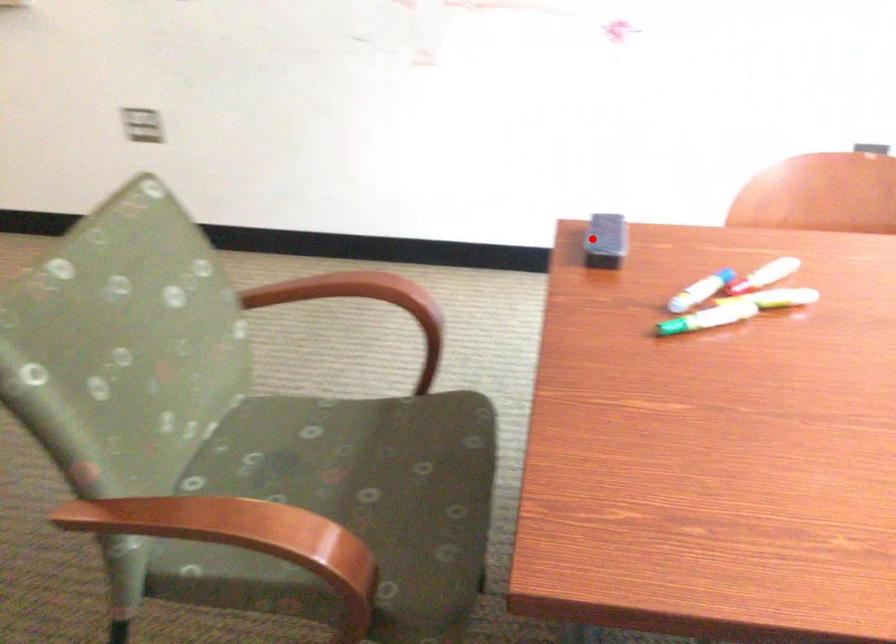
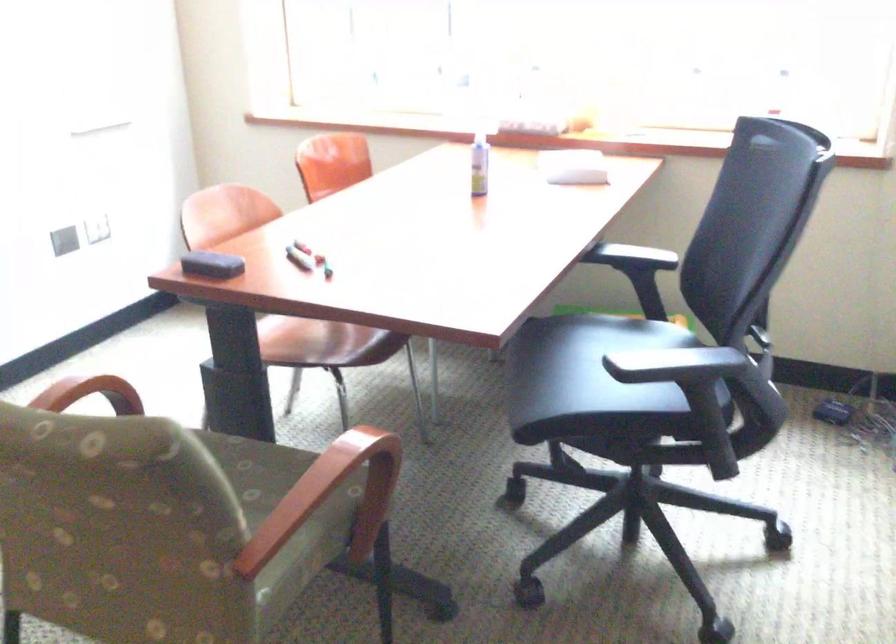
Question: I am providing you with two images of the same scene from different viewpoints. A red point is shown in image1. For the corresponding object point in image2, is it positioned nearer or farther from the camera?

Choices:
 (A) Nearer
 (B) Farther

Answer: (B)